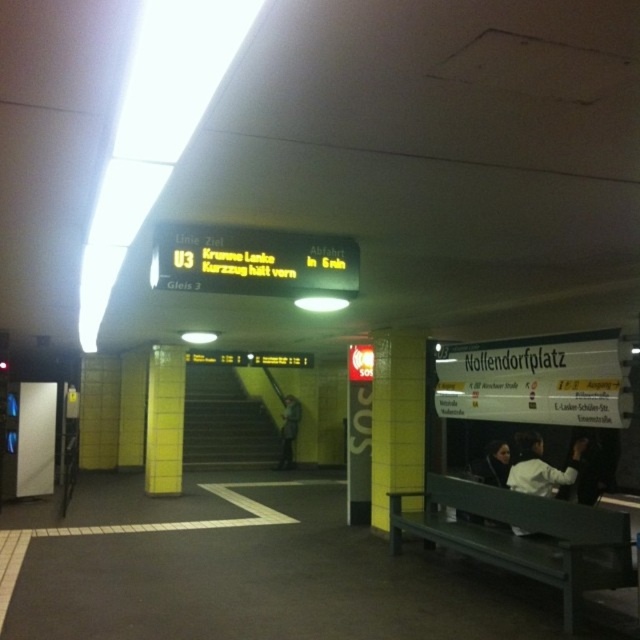
Question: Among these points, which one is nearest to the camera?

Choices:
 (A) (506, 461)
 (B) (516, 460)

Answer: (B)

Question: Can you confirm if green metal bench at lower right is wider than dark brown leather jacket at lower right?

Choices:
 (A) yes
 (B) no

Answer: (A)

Question: Is green metal bench at lower right below white matte jacket at lower right?

Choices:
 (A) no
 (B) yes

Answer: (B)

Question: Which object is the closest to the green metal bench at lower right?

Choices:
 (A) dark gray sweater at right
 (B) dark brown leather jacket at lower right
 (C) white matte jacket at lower right

Answer: (C)

Question: Does dark gray sweater at right appear over dark brown leather jacket at lower right?

Choices:
 (A) yes
 (B) no

Answer: (B)

Question: Considering the real-world distances, which object is farthest from the dark gray sweater at right?

Choices:
 (A) dark brown leather jacket at lower right
 (B) green metal bench at lower right
 (C) dark gray jacket at center
 (D) white matte jacket at lower right

Answer: (C)